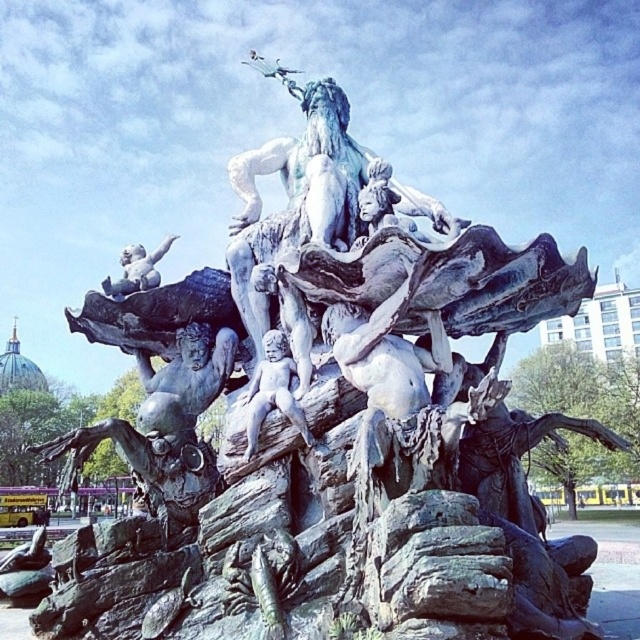
Can you confirm if matte bronze cherub at center is positioned below bronze cherub at upper left?

Indeed, matte bronze cherub at center is positioned under bronze cherub at upper left.

This screenshot has height=640, width=640. Describe the element at coordinates (273, 390) in the screenshot. I see `matte bronze cherub at center` at that location.

The width and height of the screenshot is (640, 640). In order to click on matte bronze cherub at center in this screenshot , I will do `click(273, 390)`.

At what (x,y) coordinates should I click in order to perform the action: click on matte bronze cherub at center. Please return your answer as a coordinate pair (x, y). The image size is (640, 640). Looking at the image, I should click on (273, 390).